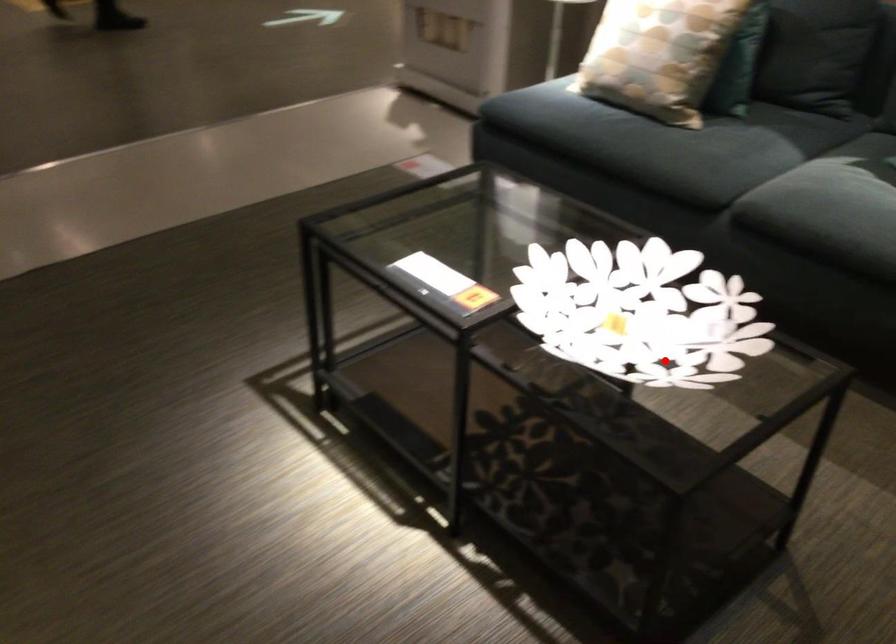
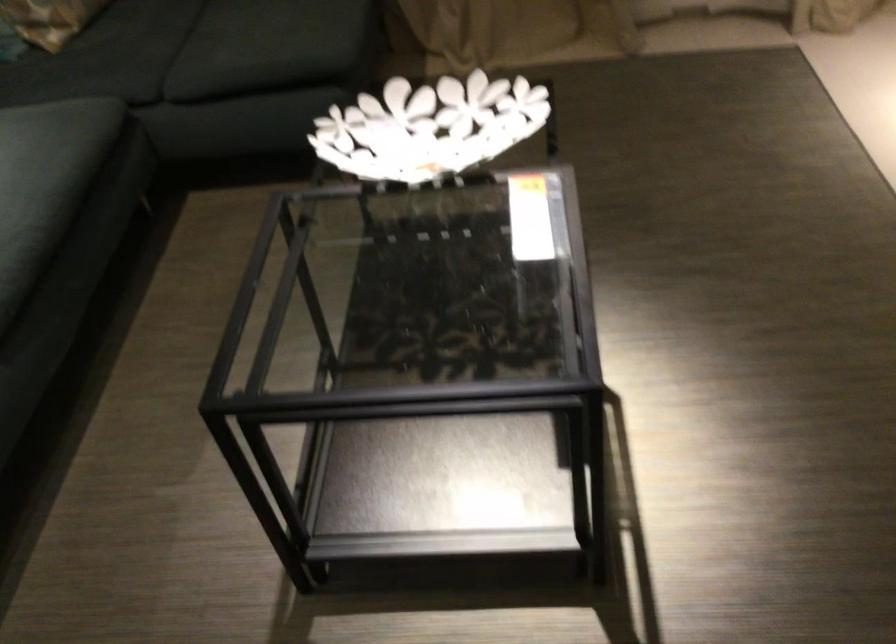
Question: I am providing you with two images of the same scene from different viewpoints. A red point is shown in image1. For the corresponding object point in image2, is it positioned nearer or farther from the camera?

Choices:
 (A) Nearer
 (B) Farther

Answer: (B)